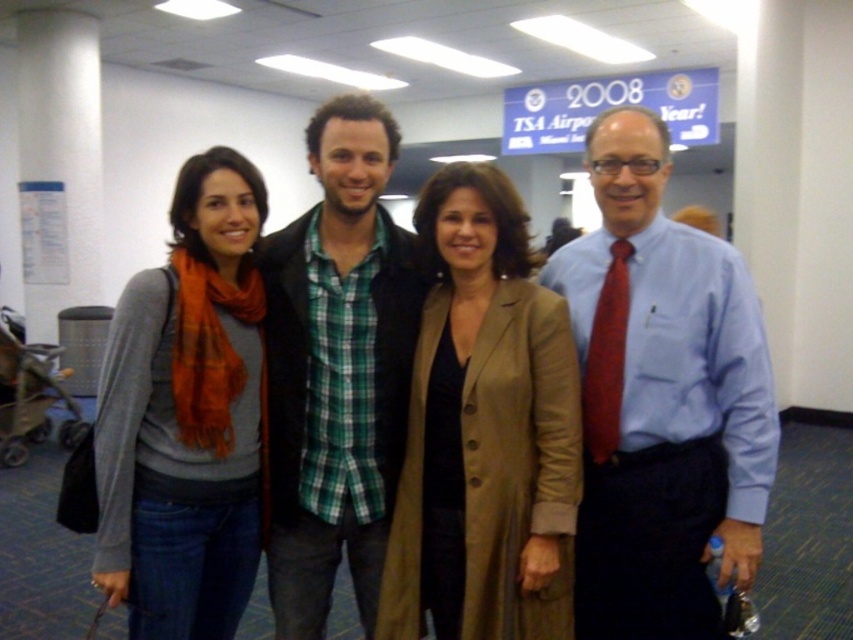
Question: Which is farther from the matte brown coat at center?

Choices:
 (A) matte blue shirt at center
 (B) matte orange scarf at left
 (C) green plaid shirt at center

Answer: (B)

Question: Estimate the real-world distances between objects in this image. Which object is closer to the matte brown coat at center?

Choices:
 (A) green plaid shirt at center
 (B) matte orange scarf at left
 (C) matte blue shirt at center

Answer: (A)

Question: Observing the image, what is the correct spatial positioning of matte brown coat at center in reference to green plaid shirt at center?

Choices:
 (A) left
 (B) right

Answer: (B)

Question: Can you confirm if matte brown coat at center is positioned to the left of matte orange scarf at left?

Choices:
 (A) no
 (B) yes

Answer: (A)

Question: Does matte blue shirt at center appear on the left side of green plaid shirt at center?

Choices:
 (A) no
 (B) yes

Answer: (A)

Question: Which object is positioned farthest from the matte brown coat at center?

Choices:
 (A) matte blue shirt at center
 (B) matte orange scarf at left
 (C) green plaid shirt at center

Answer: (B)